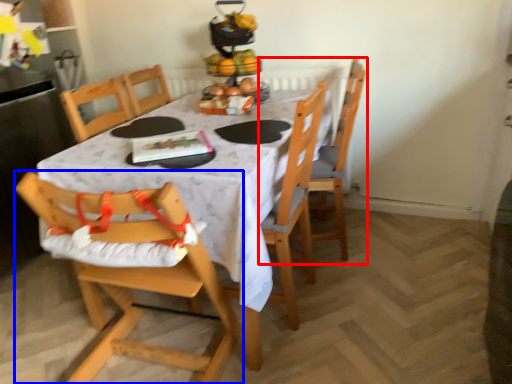
Question: Which point is further to the camera, chair (highlighted by a red box) or chair (highlighted by a blue box)?

Choices:
 (A) chair
 (B) chair

Answer: (A)